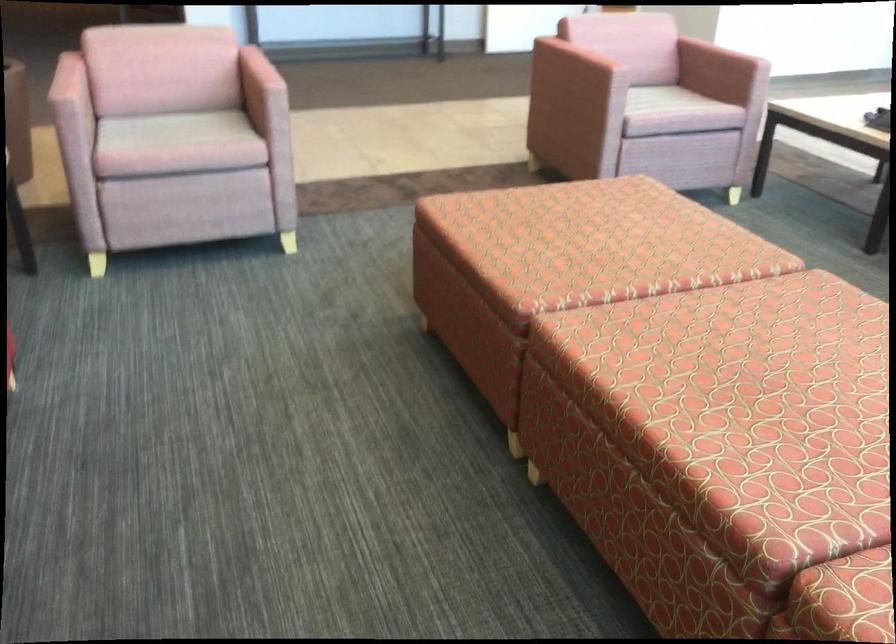
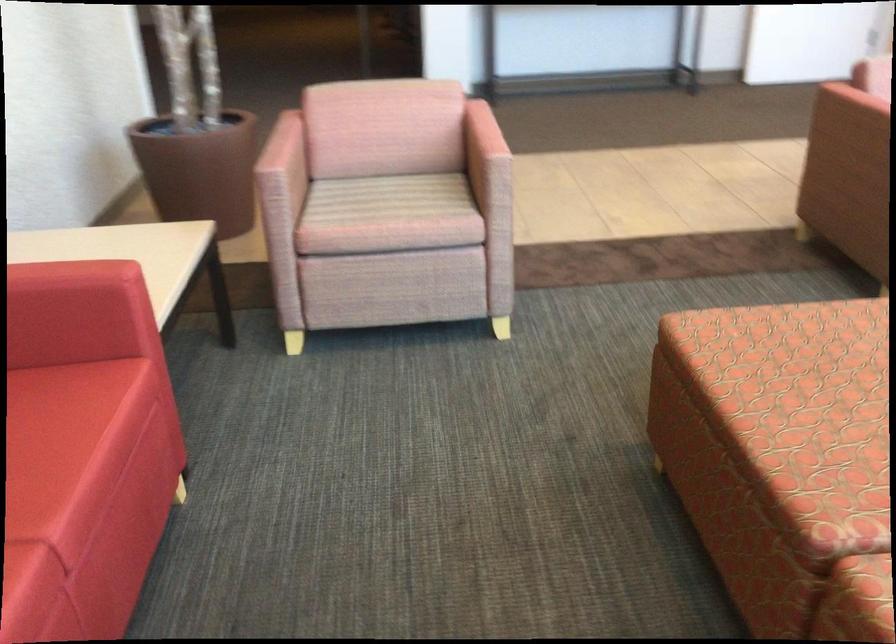
Locate, in the second image, the point that corresponds to [73,106] in the first image.

(280, 176)